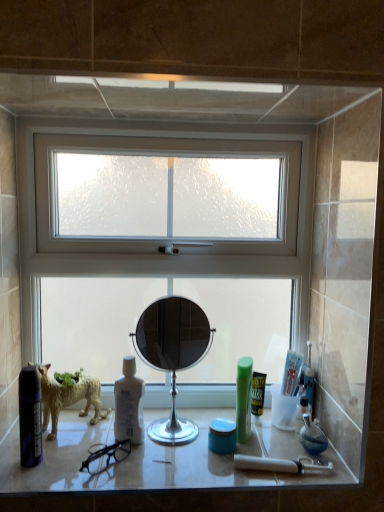
Locate an element on the screen. vacant space in front of blue matte jar at center, arranged as the second mouthwash when viewed from the right is located at coordinates (223, 474).